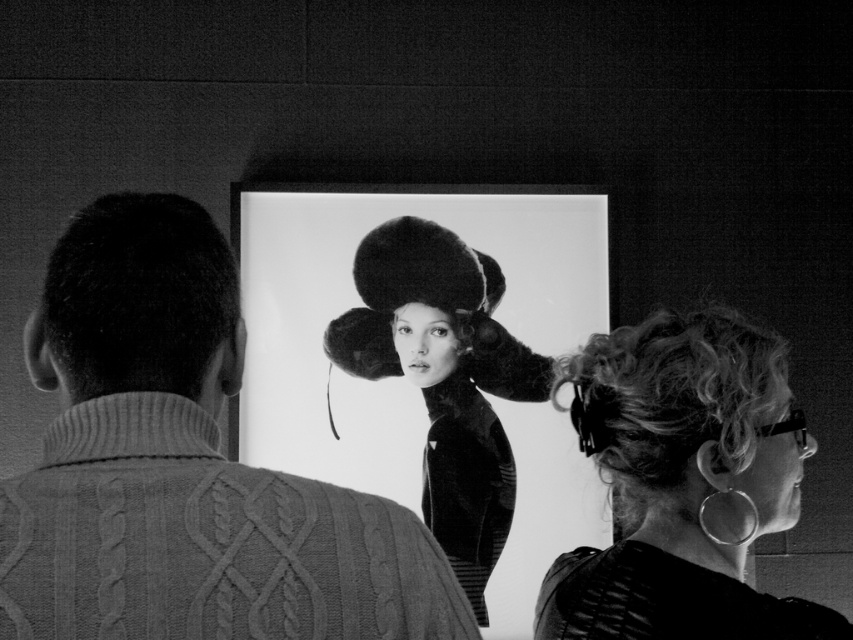
Which is below, fuzzy fur hat at center or dark curly hair at left?

fuzzy fur hat at center is below.

Describe the element at coordinates (444, 378) in the screenshot. I see `fuzzy fur hat at center` at that location.

Locate an element on the screen. fuzzy fur hat at center is located at coordinates (444, 378).

Which is below, cable-knit sweater at center or fuzzy fur hat at center?

fuzzy fur hat at center

Between cable-knit sweater at center and fuzzy fur hat at center, which one appears on the left side from the viewer's perspective?

cable-knit sweater at center

Does point (451, 580) come behind point (368, 374)?

No, it is not.

The width and height of the screenshot is (853, 640). I want to click on cable-knit sweater at center, so click(x=184, y=467).

Can you confirm if cable-knit sweater at center is taller than dark curly hair at left?

Yes.

Who is shorter, cable-knit sweater at center or dark curly hair at left?

dark curly hair at left is shorter.

Measure the distance between cable-knit sweater at center and camera.

cable-knit sweater at center and camera are 35.86 inches apart from each other.

Image resolution: width=853 pixels, height=640 pixels. I want to click on cable-knit sweater at center, so click(184, 467).